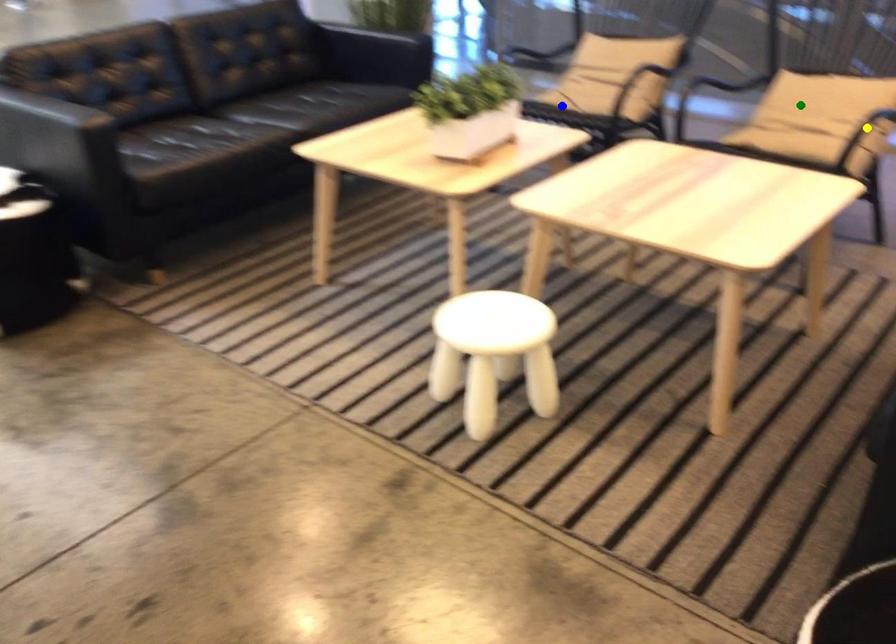
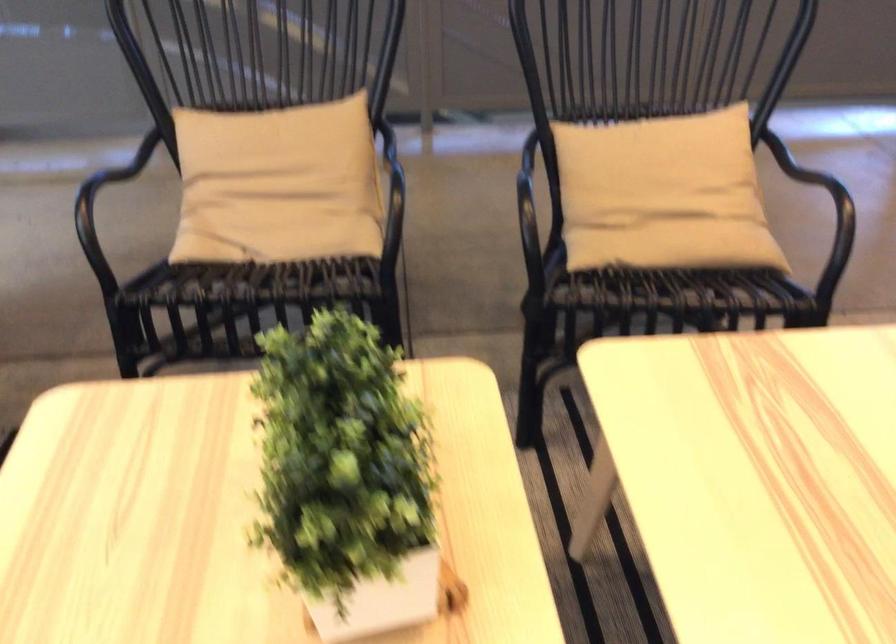
I am providing you with two images of the same scene from different viewpoints. Three points are marked in image1. Which point corresponds to a part or object that is occluded in image2?In image1, three points are marked. Which of them correspond to a part or object that is occluded in image2?Among the three points shown in image1, which one corresponds to a part or object that is no longer visible due to occlusion in image2?

yellow point